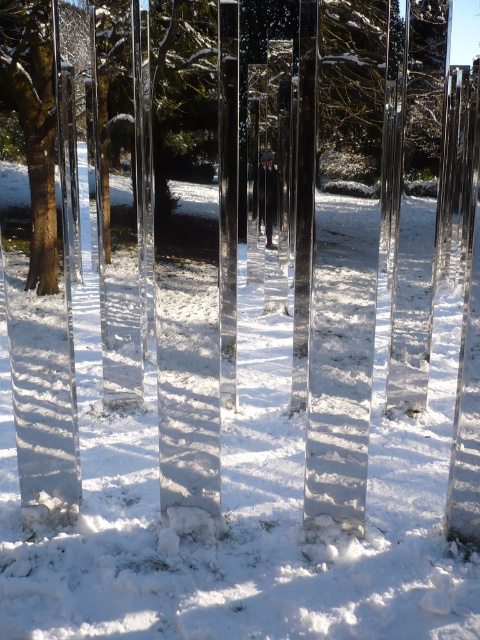
Question: Is white glossy snow at center positioned behind brown wood tree at left?

Choices:
 (A) no
 (B) yes

Answer: (A)

Question: Which object appears farthest from the camera in this image?

Choices:
 (A) white glossy snow at center
 (B) brown wood tree at left

Answer: (B)

Question: Which object is farther from the camera taking this photo?

Choices:
 (A) white glossy snow at center
 (B) brown wood tree at left

Answer: (B)

Question: Is white glossy snow at center behind brown wood tree at left?

Choices:
 (A) no
 (B) yes

Answer: (A)

Question: Is white glossy snow at center above brown wood tree at left?

Choices:
 (A) no
 (B) yes

Answer: (A)